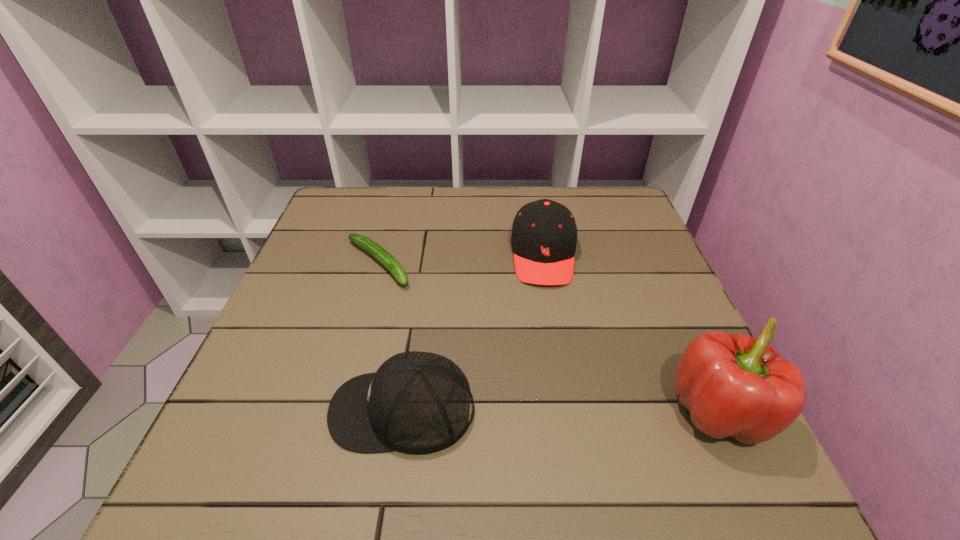
Identify the location of vacant space on the desktop that is between the nearer cap and the pepper and is positioned on the front-facing side of the zucchini. The height and width of the screenshot is (540, 960). (543, 411).

This screenshot has width=960, height=540. I want to click on vacant space on the desktop that is between the left cap and the tallest object and is positioned on the front-facing side of the farther cap, so click(x=554, y=411).